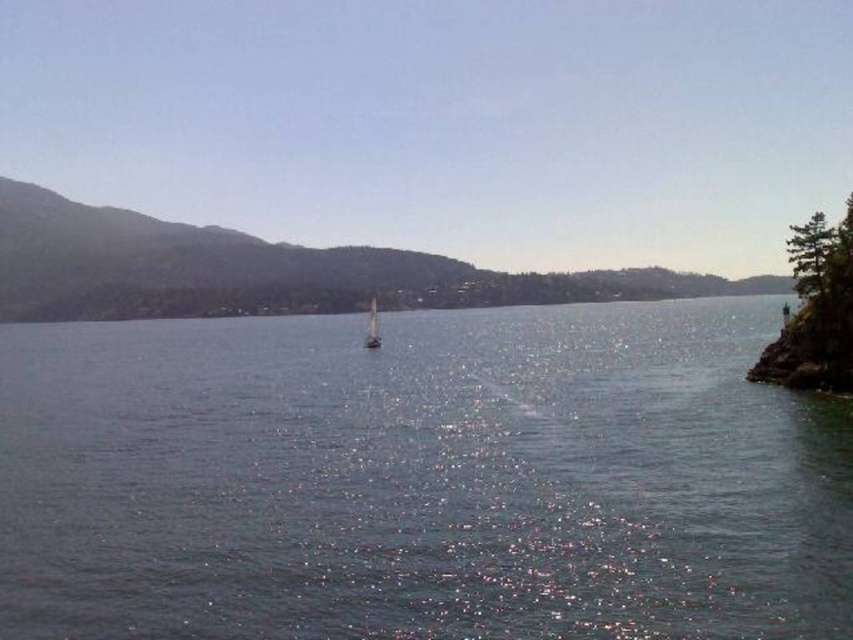
Question: Does clear water at center have a greater width compared to white glossy sailboat at center?

Choices:
 (A) no
 (B) yes

Answer: (B)

Question: Is clear water at center below white glossy sailboat at center?

Choices:
 (A) no
 (B) yes

Answer: (B)

Question: Which point is farther to the camera?

Choices:
 (A) (457, 442)
 (B) (370, 300)

Answer: (B)

Question: Does clear water at center have a larger size compared to white glossy sailboat at center?

Choices:
 (A) no
 (B) yes

Answer: (B)

Question: Among these points, which one is nearest to the camera?

Choices:
 (A) pos(712,378)
 (B) pos(368,308)

Answer: (A)